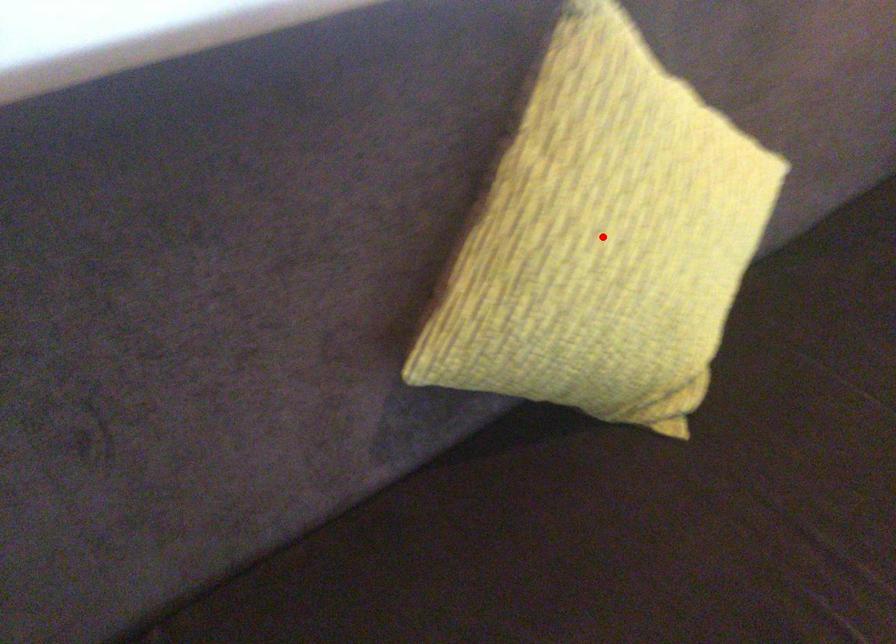
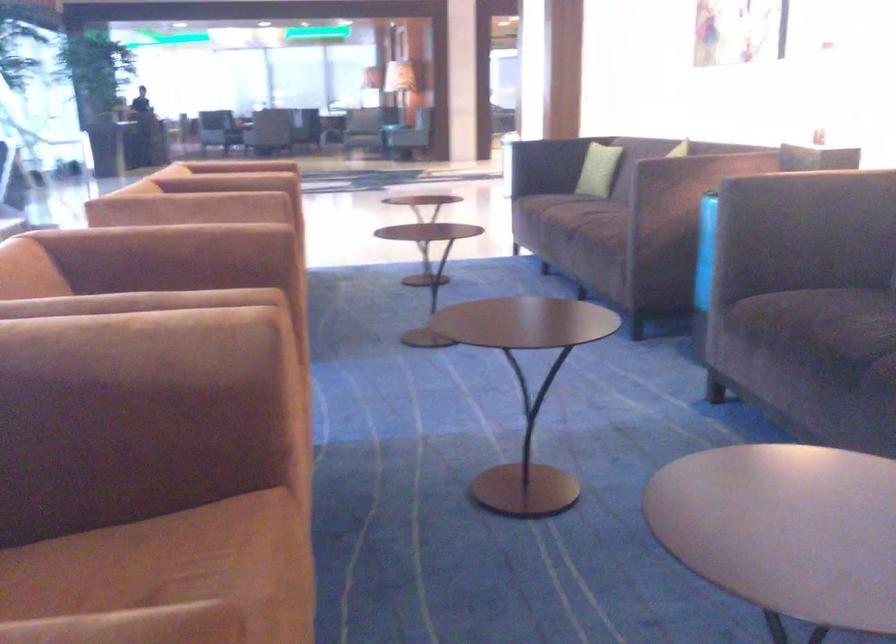
Question: I am providing you with two images of the same scene from different viewpoints. A red point is marked on the first image. Is the red point's position out of view in image 2?

Choices:
 (A) Yes
 (B) No

Answer: (A)